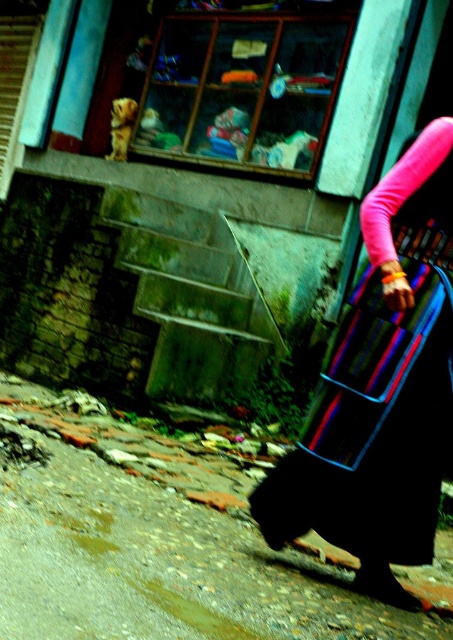
Does point (229, 497) lie in front of point (362, 547)?

No, it is behind (362, 547).

Who is positioned more to the right, brick pavement at lower left or multicolored woven bag at right?

Positioned to the right is multicolored woven bag at right.

Find the location of a particular element. brick pavement at lower left is located at coordinates (159, 545).